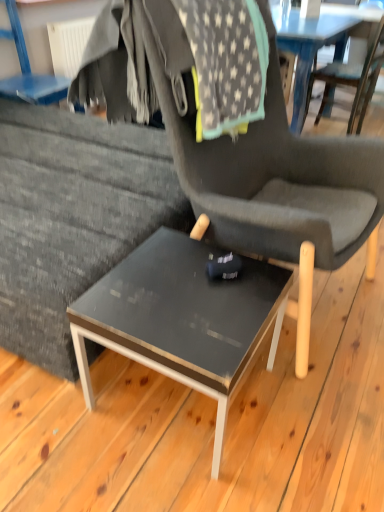
Question: Considering the positions of wooden chair at center, arranged as the first chair when viewed from the right, and matte black chair at center, the 2th chair from the left, in the image, is wooden chair at center, arranged as the first chair when viewed from the right, wider or thinner than matte black chair at center, the 2th chair from the left,?

Choices:
 (A) wide
 (B) thin

Answer: (B)

Question: Is wooden chair at center, which is the 3th chair in left-to-right order, situated inside matte black chair at center, the 2th chair from the left, or outside?

Choices:
 (A) inside
 (B) outside

Answer: (B)

Question: Based on their relative distances, which object is farther from the wooden chair at center, which is the 3th chair in left-to-right order?

Choices:
 (A) matte black table at center
 (B) matte black chair at center, the 2th chair from the left
 (C) matte gray chair at upper left, arranged as the 1th chair when viewed from the left

Answer: (A)

Question: Which of these objects is positioned farthest from the matte black table at center?

Choices:
 (A) matte black chair at center, the 2th chair in the right-to-left sequence
 (B) matte gray chair at upper left, arranged as the 1th chair when viewed from the left
 (C) wooden chair at center, which is the 3th chair in left-to-right order

Answer: (C)